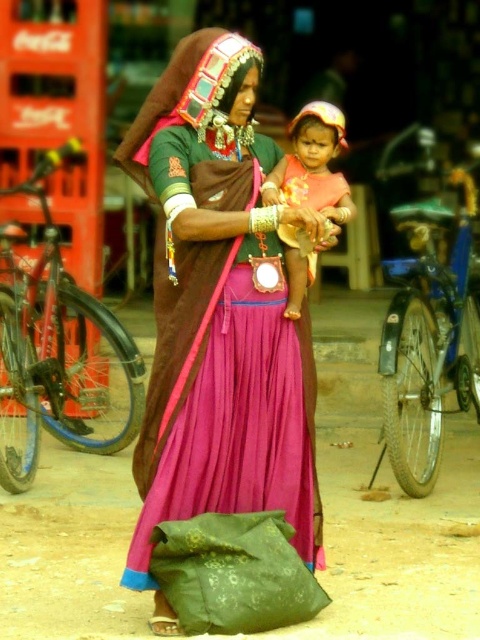
Question: Which of the following is the farthest from the observer?

Choices:
 (A) pink satin saree at center
 (B) matte pink fabric at center

Answer: (B)

Question: Does pink satin saree at center appear under matte pink fabric at center?

Choices:
 (A) no
 (B) yes

Answer: (B)

Question: Observing the image, what is the correct spatial positioning of pink satin saree at center in reference to matte pink fabric at center?

Choices:
 (A) above
 (B) below

Answer: (B)

Question: Which point is closer to the camera?

Choices:
 (A) (205, 122)
 (B) (325, 136)

Answer: (A)

Question: Is pink satin saree at center in front of matte pink fabric at center?

Choices:
 (A) yes
 (B) no

Answer: (A)

Question: Which point is closer to the camera?

Choices:
 (A) (226, 461)
 (B) (310, 204)

Answer: (A)